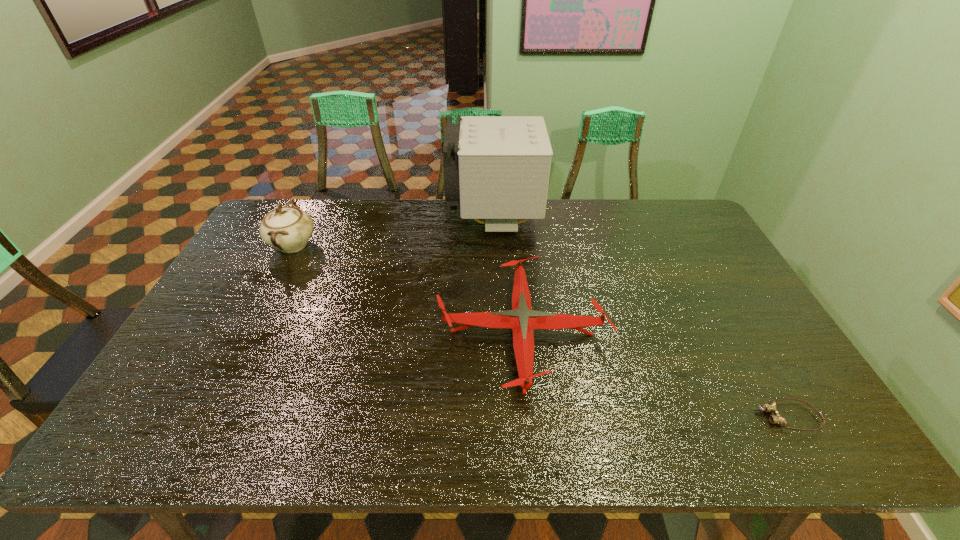
Find the location of a particular element. the tallest object is located at coordinates (497, 168).

Locate an element on the screen. The width and height of the screenshot is (960, 540). the second tallest object is located at coordinates 288,229.

Where is `chinaware`? The image size is (960, 540). chinaware is located at coordinates (288, 229).

Locate an element on the screen. This screenshot has height=540, width=960. drone is located at coordinates (523, 320).

Locate an element on the screen. the rightmost object is located at coordinates (771, 407).

The width and height of the screenshot is (960, 540). I want to click on goggles, so click(771, 407).

Where is `blank space located 0.120m on the right of the tallest object`? blank space located 0.120m on the right of the tallest object is located at coordinates pos(572,221).

This screenshot has height=540, width=960. Identify the location of free space located 0.130m on the front of the leftmost object. (268, 294).

Where is `free space located on the front of the drone`? The image size is (960, 540). free space located on the front of the drone is located at coordinates (530, 428).

Find the location of a particular element. Image resolution: width=960 pixels, height=540 pixels. vacant space positioned on the front lenses and sides of the rightmost object is located at coordinates (637, 417).